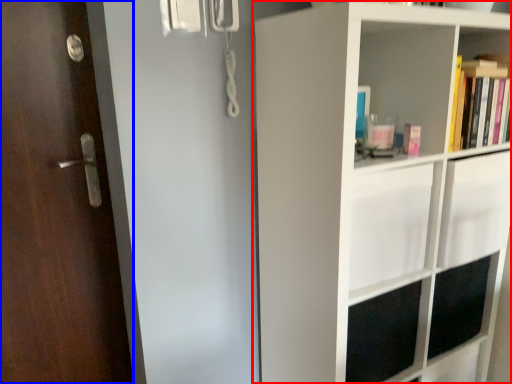
Question: Which object is closer to the camera taking this photo, shelf (highlighted by a red box) or door (highlighted by a blue box)?

Choices:
 (A) shelf
 (B) door

Answer: (A)